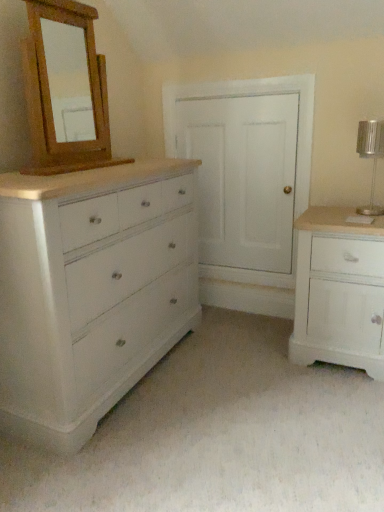
Question: Is silver metallic table lamp at right wider than wooden mirror at upper left?

Choices:
 (A) no
 (B) yes

Answer: (B)

Question: Is silver metallic table lamp at right turned away from wooden mirror at upper left?

Choices:
 (A) yes
 (B) no

Answer: (B)

Question: From a real-world perspective, is silver metallic table lamp at right physically above wooden mirror at upper left?

Choices:
 (A) no
 (B) yes

Answer: (A)

Question: Is silver metallic table lamp at right oriented towards wooden mirror at upper left?

Choices:
 (A) no
 (B) yes

Answer: (A)

Question: From the image's perspective, is silver metallic table lamp at right below wooden mirror at upper left?

Choices:
 (A) yes
 (B) no

Answer: (A)

Question: Considering the positions of wooden mirror at upper left and white painted wood chest of drawers at left, marked as the second chest of drawers in a right-to-left arrangement, in the image, is wooden mirror at upper left taller or shorter than white painted wood chest of drawers at left, marked as the second chest of drawers in a right-to-left arrangement,?

Choices:
 (A) tall
 (B) short

Answer: (B)

Question: From the image's perspective, is wooden mirror at upper left positioned above or below white painted wood chest of drawers at left, the 1th chest of drawers viewed from the left?

Choices:
 (A) above
 (B) below

Answer: (A)

Question: In the image, is wooden mirror at upper left positioned in front of or behind white painted wood chest of drawers at left, marked as the second chest of drawers in a right-to-left arrangement?

Choices:
 (A) front
 (B) behind

Answer: (B)

Question: Is point (99, 143) positioned closer to the camera than point (120, 371)?

Choices:
 (A) closer
 (B) farther

Answer: (B)

Question: From the image's perspective, relative to white painted wood cabinet at right, which is counted as the 1th chest of drawers, starting from the right, is silver metallic table lamp at right above or below?

Choices:
 (A) below
 (B) above

Answer: (B)

Question: Considering their positions, is silver metallic table lamp at right located in front of or behind white painted wood cabinet at right, which is counted as the 1th chest of drawers, starting from the right?

Choices:
 (A) behind
 (B) front

Answer: (A)

Question: Is silver metallic table lamp at right wider or thinner than white painted wood cabinet at right, which is counted as the 1th chest of drawers, starting from the right?

Choices:
 (A) wide
 (B) thin

Answer: (B)

Question: From a real-world perspective, relative to white painted wood cabinet at right, which is counted as the 1th chest of drawers, starting from the right, is silver metallic table lamp at right vertically above or below?

Choices:
 (A) above
 (B) below

Answer: (A)

Question: From a real-world perspective, is silver metallic table lamp at right above or below wooden mirror at upper left?

Choices:
 (A) above
 (B) below

Answer: (B)

Question: Is silver metallic table lamp at right spatially inside wooden mirror at upper left, or outside of it?

Choices:
 (A) outside
 (B) inside

Answer: (A)